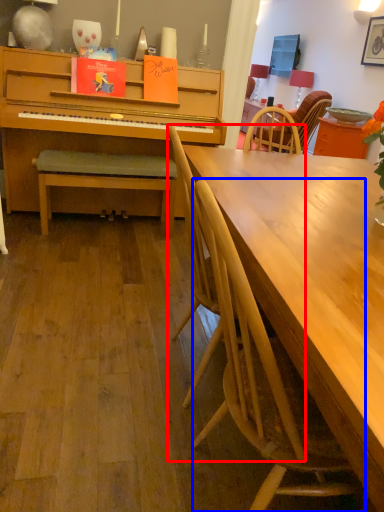
Question: Among these objects, which one is nearest to the camera, chair (highlighted by a red box) or chair (highlighted by a blue box)?

Choices:
 (A) chair
 (B) chair

Answer: (B)